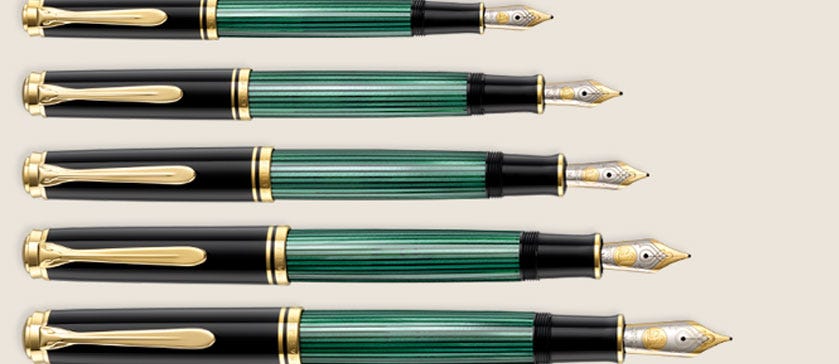
Where is `pen clips`? pen clips is located at coordinates (144, 9), (137, 94), (143, 171), (148, 256), (163, 342).